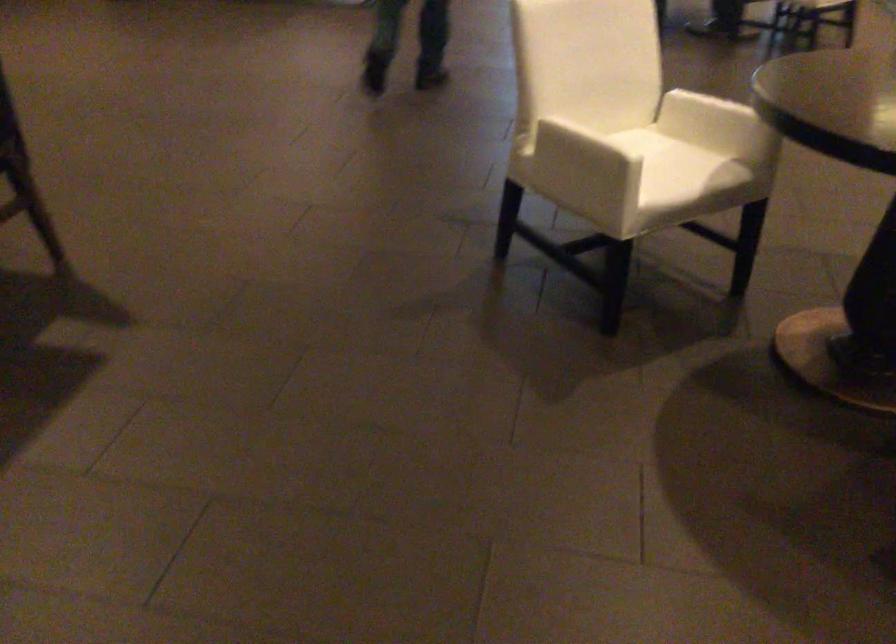
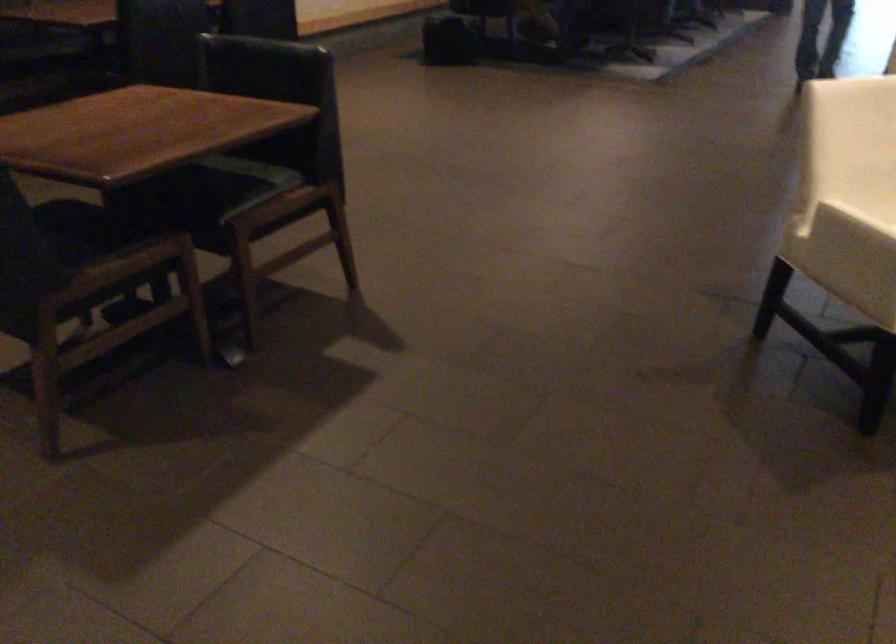
Question: The camera is either moving clockwise (left) or counter-clockwise (right) around the object. The first image is from the beginning of the video and the second image is from the end. Is the camera moving left or right when shooting the video?

Choices:
 (A) Left
 (B) Right

Answer: (B)